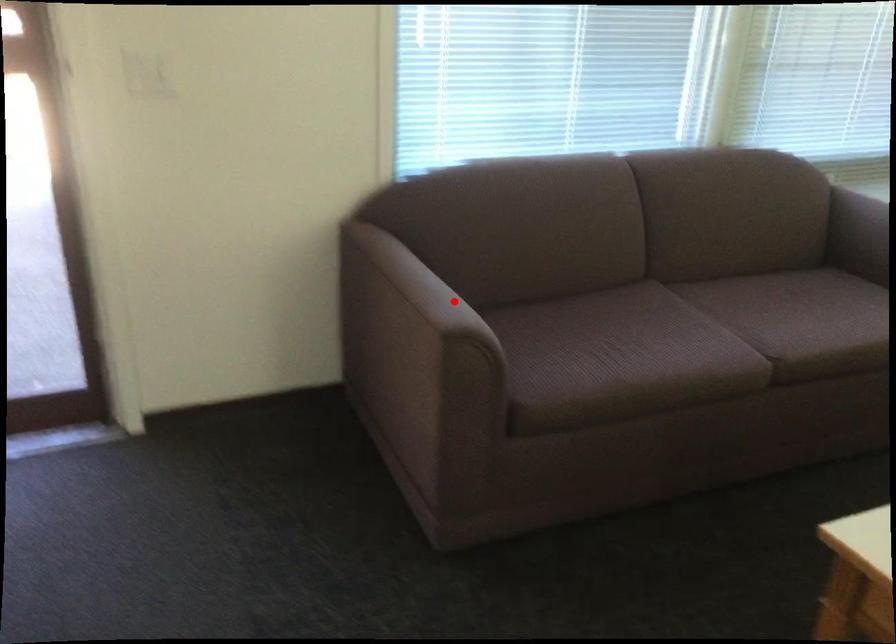
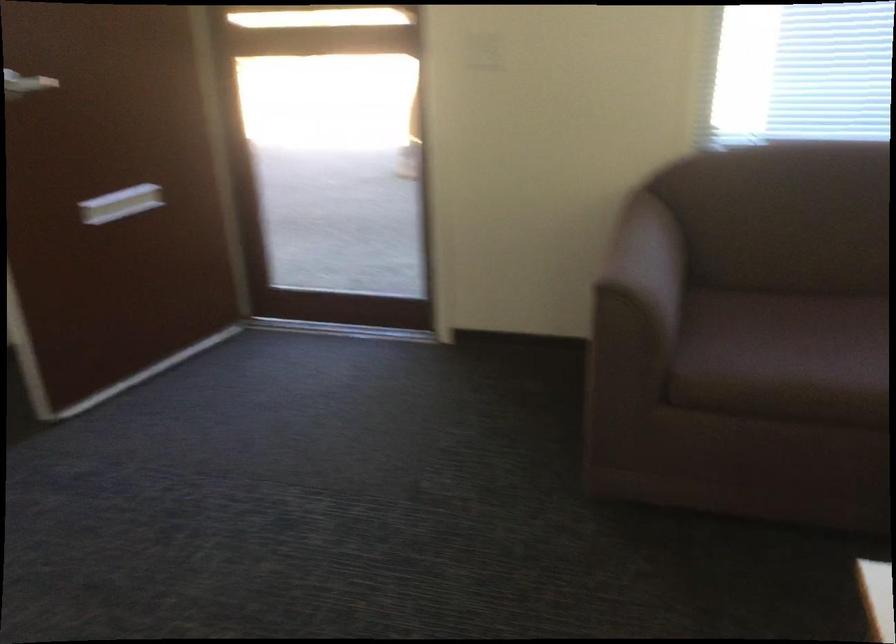
Locate, in the second image, the point that corresponds to the highlighted location in the first image.

(648, 261)